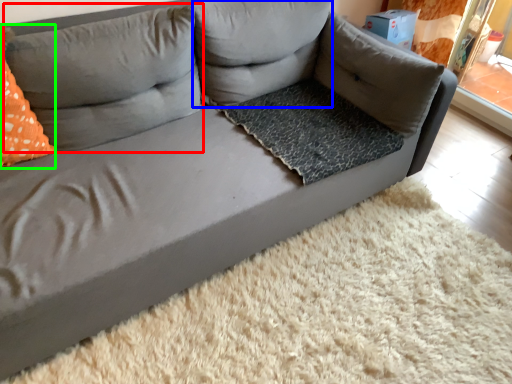
Question: Which object is the closest to the pillow (highlighted by a red box)? Choose among these: pillow (highlighted by a blue box) or throw pillow (highlighted by a green box).

Choices:
 (A) pillow
 (B) throw pillow

Answer: (B)